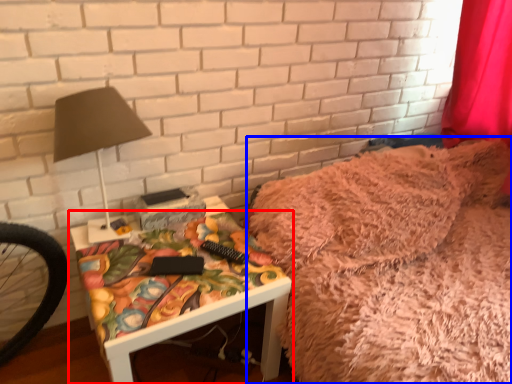
Question: Which point is further to the camera, furniture (highlighted by a red box) or bed (highlighted by a blue box)?

Choices:
 (A) furniture
 (B) bed

Answer: (B)